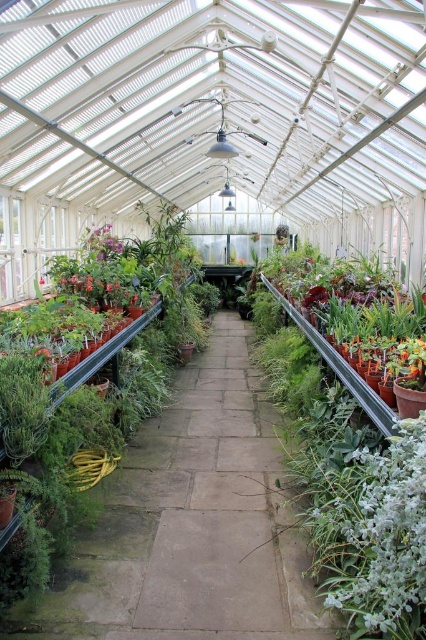
You are a gardener who needs to water the green succulent at right and the pink matte flower at center. Since you can only carry one watering can at a time, which plant should you water first to minimize walking distance?

Result: You should water the green succulent at right first because it is in front of the pink matte flower at center, so you can reach it without needing to move further back.

You are a gardener planning to place a new plant pot that is 30 cm wide between the green succulent at right and the green matte plant at left. Based on their widths, which existing plant should you consider moving to accommodate the new pot?

The green succulent at right is wider than the green matte plant at left. To accommodate the new 30 cm wide pot, you should consider moving the green succulent at right since it is wider and may require more space adjustment.

You are standing in the greenhouse and want to water the green succulent at right. If your watering can has a maximum reach of 5 feet, can you water it without moving closer?

The green succulent at right is 5.11 feet away from the viewer, which is beyond the watering can reach of 5 feet. You need to move closer to reach it.